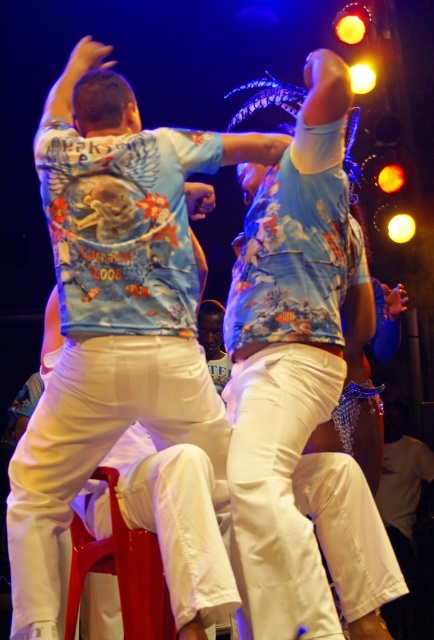
Is point (95, 324) positioned behind point (324, 586)?

Yes, point (95, 324) is farther from viewer.

Which is in front, point (135, 272) or point (324, 605)?

Point (324, 605) is in front.

Does point (217, 442) lie behind point (256, 172)?

No, (217, 442) is closer to viewer.

The height and width of the screenshot is (640, 434). Identify the location of blue printed shirt at upper center. 112,308.